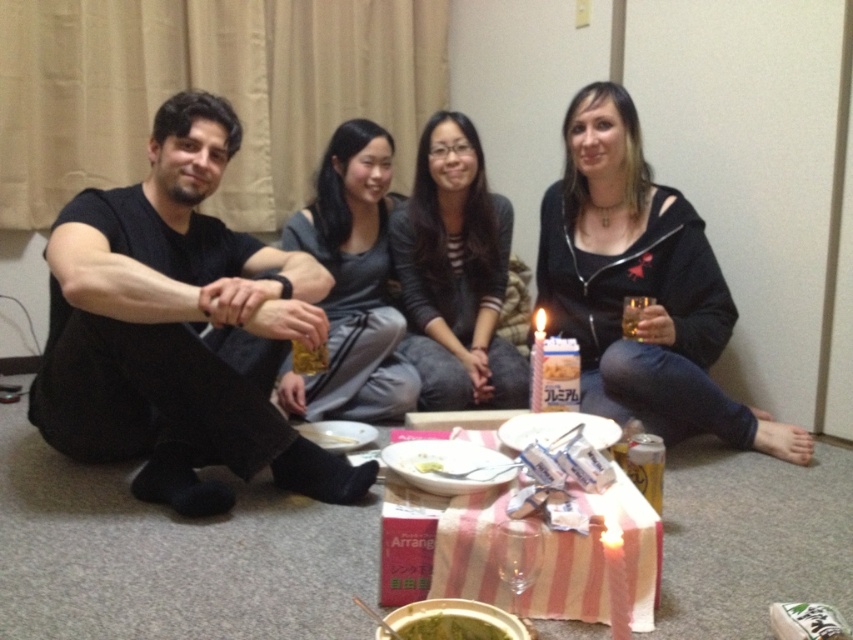
Is green matte bowl at center shorter than translucent glass beverage at lower center?

Indeed, green matte bowl at center has a lesser height compared to translucent glass beverage at lower center.

Which of these two, green matte bowl at center or translucent glass beverage at lower center, stands shorter?

green matte bowl at center is shorter.

Identify the location of green matte bowl at center. This screenshot has height=640, width=853. (450, 627).

Does translucent glass at center lie behind smooth white cake at center?

Yes, it is behind smooth white cake at center.

Does point (628, 301) lie behind point (561, 365)?

That is True.

Does point (630, 337) lie in front of point (575, 356)?

That is False.

I want to click on translucent glass at center, so click(x=633, y=314).

Consider the image. Can you confirm if black hoodie at center is positioned to the left of translucent glass at center?

No, black hoodie at center is not to the left of translucent glass at center.

Can you confirm if black hoodie at center is smaller than translucent glass at center?

No.

Describe the element at coordinates (640, 285) in the screenshot. I see `black hoodie at center` at that location.

You are a GUI agent. You are given a task and a screenshot of the screen. Output one action in this format:
    pyautogui.click(x=<x>, y=<y>)
    Task: Click on the black hoodie at center
    Image resolution: width=853 pixels, height=640 pixels.
    Given the screenshot: What is the action you would take?
    pyautogui.click(x=640, y=285)